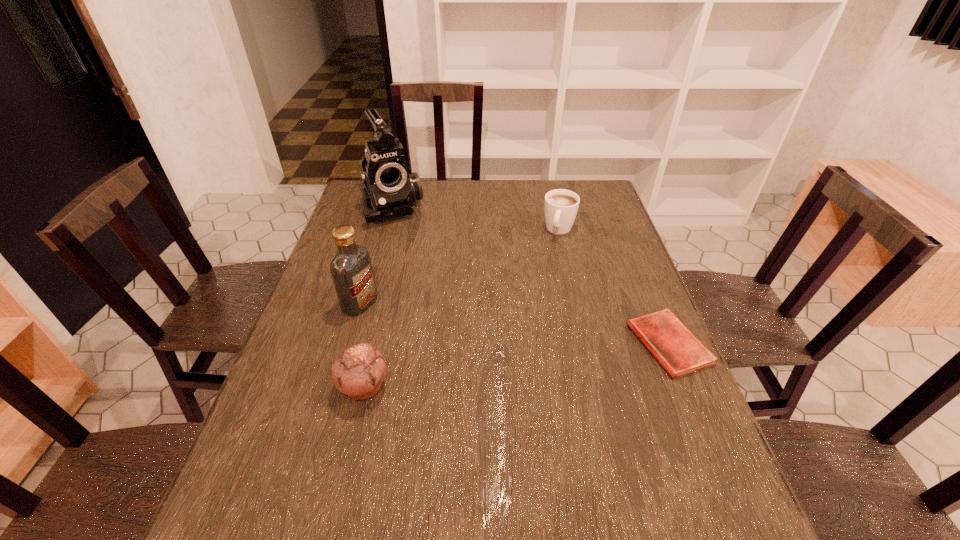
Identify the location of free space on the desktop that is between the muffin and the shortest object and is positioned with the handle on the side of the cappuccino. Image resolution: width=960 pixels, height=540 pixels. (512, 366).

Locate an element on the screen. This screenshot has height=540, width=960. vacant space on the desktop that is between the muffin and the shortest object and is positioned on the front-facing side of the vodka is located at coordinates pyautogui.click(x=505, y=367).

Where is `free space on the desktop that is between the muffin and the rightmost object and is positioned on the lens mount of the camcorder`? Image resolution: width=960 pixels, height=540 pixels. free space on the desktop that is between the muffin and the rightmost object and is positioned on the lens mount of the camcorder is located at coordinates (483, 369).